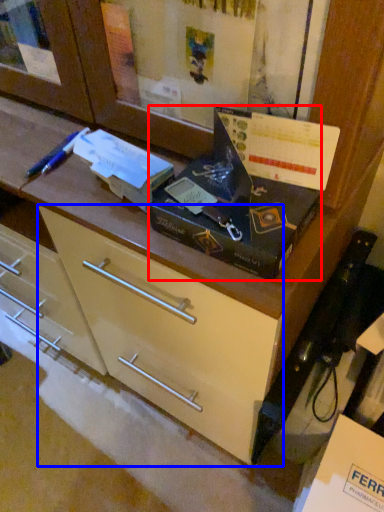
Question: Which object is further to the camera taking this photo, box (highlighted by a red box) or drawer (highlighted by a blue box)?

Choices:
 (A) box
 (B) drawer

Answer: (B)